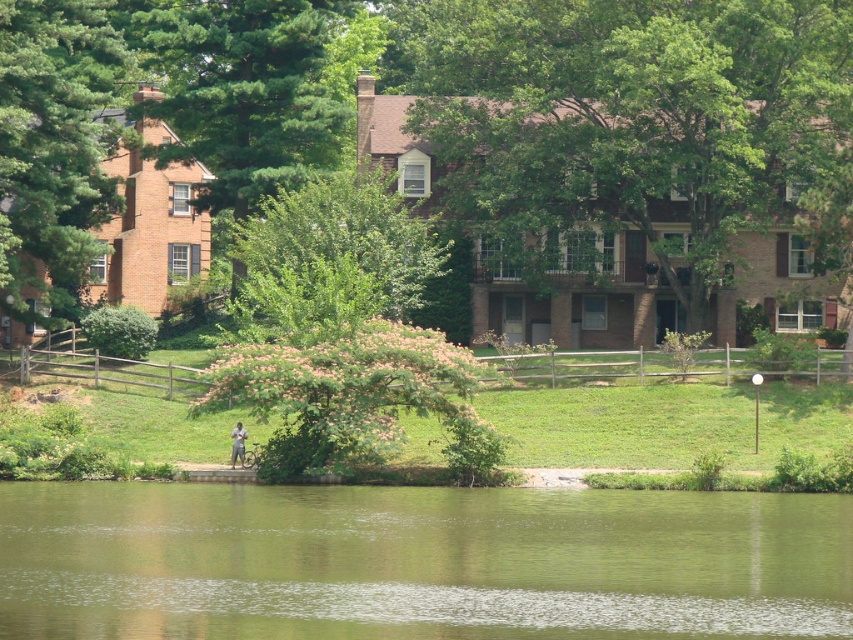
You are standing at the point marked by the coordinates (354, 397) in the image. Looking around, you see a pink fluffy tree at center. Which direction would you face to look towards the water?

The pink fluffy tree at center is located at the coordinates (354, 397). Since the water is in the foreground, facing towards the water would mean looking in the direction opposite to the background. Therefore, you should face forward to look towards the water.

In the scene shown: You are standing at the edge of the suburban scene and want to take a photo of both the green liquid water at lower center and the pink fluffy tree at center. Which object should you focus on first to ensure both are in the frame?

You should focus on the green liquid water at lower center first since it is closer to you than the pink fluffy tree at center, allowing both to be in the frame when properly focused.